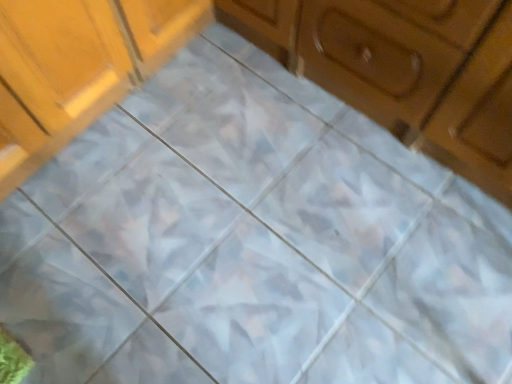
What do you see at coordinates (404, 69) in the screenshot? I see `wooden cabinet at upper right, which ranks as the second cabinetry in left-to-right order` at bounding box center [404, 69].

Where is `wooden cabinet at upper right, which ranks as the second cabinetry in left-to-right order`? wooden cabinet at upper right, which ranks as the second cabinetry in left-to-right order is located at coordinates (404, 69).

How much space does wooden cabinet at upper right, which ranks as the second cabinetry in left-to-right order, occupy vertically?

wooden cabinet at upper right, which ranks as the second cabinetry in left-to-right order, is 21.00 inches tall.

I want to click on matte wood cabinet at upper left, which is counted as the second cabinetry, starting from the right, so click(77, 67).

The height and width of the screenshot is (384, 512). What do you see at coordinates (77, 67) in the screenshot? I see `matte wood cabinet at upper left, placed as the first cabinetry when sorted from left to right` at bounding box center [77, 67].

This screenshot has width=512, height=384. I want to click on wooden cabinet at upper right, which ranks as the second cabinetry in left-to-right order, so click(404, 69).

Is matte wood cabinet at upper left, placed as the first cabinetry when sorted from left to right, to the right of wooden cabinet at upper right, which ranks as the second cabinetry in left-to-right order, from the viewer's perspective?

Incorrect, matte wood cabinet at upper left, placed as the first cabinetry when sorted from left to right, is not on the right side of wooden cabinet at upper right, which ranks as the second cabinetry in left-to-right order.

Is matte wood cabinet at upper left, which is counted as the second cabinetry, starting from the right, behind wooden cabinet at upper right, which ranks as the second cabinetry in left-to-right order?

Yes, it is.

Which is closer, (40, 130) or (325, 37)?

Positioned in front is point (325, 37).

From the image's perspective, is matte wood cabinet at upper left, placed as the first cabinetry when sorted from left to right, above or below wooden cabinet at upper right, which ranks as the second cabinetry in left-to-right order?

matte wood cabinet at upper left, placed as the first cabinetry when sorted from left to right, is above wooden cabinet at upper right, which ranks as the second cabinetry in left-to-right order.

From a real-world perspective, between matte wood cabinet at upper left, which is counted as the second cabinetry, starting from the right, and wooden cabinet at upper right, the first cabinetry positioned from the right, who is vertically higher?

From a 3D spatial view, wooden cabinet at upper right, the first cabinetry positioned from the right, is above.

Does matte wood cabinet at upper left, which is counted as the second cabinetry, starting from the right, have a lesser width compared to wooden cabinet at upper right, the first cabinetry positioned from the right?

No.

Between matte wood cabinet at upper left, which is counted as the second cabinetry, starting from the right, and wooden cabinet at upper right, which ranks as the second cabinetry in left-to-right order, which one has more height?

wooden cabinet at upper right, which ranks as the second cabinetry in left-to-right order.

Considering the relative sizes of matte wood cabinet at upper left, which is counted as the second cabinetry, starting from the right, and wooden cabinet at upper right, which ranks as the second cabinetry in left-to-right order, in the image provided, is matte wood cabinet at upper left, which is counted as the second cabinetry, starting from the right, bigger than wooden cabinet at upper right, which ranks as the second cabinetry in left-to-right order,?

Incorrect, matte wood cabinet at upper left, which is counted as the second cabinetry, starting from the right, is not larger than wooden cabinet at upper right, which ranks as the second cabinetry in left-to-right order.

Does matte wood cabinet at upper left, placed as the first cabinetry when sorted from left to right, contain wooden cabinet at upper right, the first cabinetry positioned from the right?

Definitely not — wooden cabinet at upper right, the first cabinetry positioned from the right, is not inside matte wood cabinet at upper left, placed as the first cabinetry when sorted from left to right.

Are matte wood cabinet at upper left, placed as the first cabinetry when sorted from left to right, and wooden cabinet at upper right, the first cabinetry positioned from the right, beside each other?

No, matte wood cabinet at upper left, placed as the first cabinetry when sorted from left to right, is not making contact with wooden cabinet at upper right, the first cabinetry positioned from the right.

Is matte wood cabinet at upper left, which is counted as the second cabinetry, starting from the right, turned away from wooden cabinet at upper right, the first cabinetry positioned from the right?

No, wooden cabinet at upper right, the first cabinetry positioned from the right, is not at the back of matte wood cabinet at upper left, which is counted as the second cabinetry, starting from the right.

The height and width of the screenshot is (384, 512). Identify the location of cabinetry below the wooden cabinet at upper right, which ranks as the second cabinetry in left-to-right order (from a real-world perspective). pos(77,67).

Can you confirm if wooden cabinet at upper right, which ranks as the second cabinetry in left-to-right order, is positioned to the left of matte wood cabinet at upper left, placed as the first cabinetry when sorted from left to right?

In fact, wooden cabinet at upper right, which ranks as the second cabinetry in left-to-right order, is to the right of matte wood cabinet at upper left, placed as the first cabinetry when sorted from left to right.

Which object is closer to the camera taking this photo, wooden cabinet at upper right, which ranks as the second cabinetry in left-to-right order, or matte wood cabinet at upper left, placed as the first cabinetry when sorted from left to right?

wooden cabinet at upper right, which ranks as the second cabinetry in left-to-right order, is in front.

Is point (421, 95) positioned in front of point (34, 54)?

No, it is not.

From the image's perspective, between wooden cabinet at upper right, which ranks as the second cabinetry in left-to-right order, and matte wood cabinet at upper left, placed as the first cabinetry when sorted from left to right, which one is located above?

matte wood cabinet at upper left, placed as the first cabinetry when sorted from left to right, from the image's perspective.

From the picture: From a real-world perspective, who is located higher, wooden cabinet at upper right, which ranks as the second cabinetry in left-to-right order, or matte wood cabinet at upper left, which is counted as the second cabinetry, starting from the right?

wooden cabinet at upper right, which ranks as the second cabinetry in left-to-right order.

Is wooden cabinet at upper right, the first cabinetry positioned from the right, wider or thinner than matte wood cabinet at upper left, placed as the first cabinetry when sorted from left to right?

Considering their sizes, wooden cabinet at upper right, the first cabinetry positioned from the right, looks slimmer than matte wood cabinet at upper left, placed as the first cabinetry when sorted from left to right.

Does wooden cabinet at upper right, the first cabinetry positioned from the right, have a greater height compared to matte wood cabinet at upper left, which is counted as the second cabinetry, starting from the right?

Yes, wooden cabinet at upper right, the first cabinetry positioned from the right, is taller than matte wood cabinet at upper left, which is counted as the second cabinetry, starting from the right.

Which of these two, wooden cabinet at upper right, the first cabinetry positioned from the right, or matte wood cabinet at upper left, which is counted as the second cabinetry, starting from the right, is bigger?

wooden cabinet at upper right, the first cabinetry positioned from the right, is bigger.

Is wooden cabinet at upper right, the first cabinetry positioned from the right, completely or partially outside of matte wood cabinet at upper left, placed as the first cabinetry when sorted from left to right?

Yes, wooden cabinet at upper right, the first cabinetry positioned from the right, is located beyond the bounds of matte wood cabinet at upper left, placed as the first cabinetry when sorted from left to right.

Is wooden cabinet at upper right, the first cabinetry positioned from the right, far away from matte wood cabinet at upper left, which is counted as the second cabinetry, starting from the right?

No, there isn't a large distance between wooden cabinet at upper right, the first cabinetry positioned from the right, and matte wood cabinet at upper left, which is counted as the second cabinetry, starting from the right.

Looking at this image, is wooden cabinet at upper right, the first cabinetry positioned from the right, oriented away from matte wood cabinet at upper left, which is counted as the second cabinetry, starting from the right?

wooden cabinet at upper right, the first cabinetry positioned from the right, does not have its back to matte wood cabinet at upper left, which is counted as the second cabinetry, starting from the right.

How different are the orientations of wooden cabinet at upper right, which ranks as the second cabinetry in left-to-right order, and matte wood cabinet at upper left, which is counted as the second cabinetry, starting from the right, in degrees?

The facing directions of wooden cabinet at upper right, which ranks as the second cabinetry in left-to-right order, and matte wood cabinet at upper left, which is counted as the second cabinetry, starting from the right, are 90 degrees apart.

I want to click on cabinetry lying on the right of matte wood cabinet at upper left, placed as the first cabinetry when sorted from left to right, so click(x=404, y=69).

What are the coordinates of `cabinetry above the wooden cabinet at upper right, which ranks as the second cabinetry in left-to-right order (from the image's perspective)` in the screenshot? It's located at (77, 67).

Where is `cabinetry beneath the wooden cabinet at upper right, which ranks as the second cabinetry in left-to-right order (from a real-world perspective)`? This screenshot has height=384, width=512. cabinetry beneath the wooden cabinet at upper right, which ranks as the second cabinetry in left-to-right order (from a real-world perspective) is located at coordinates (77, 67).